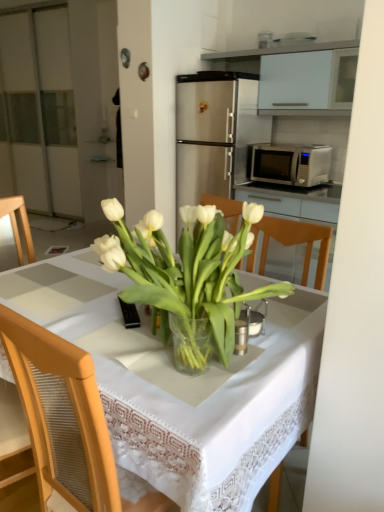
Question: Can you confirm if white glossy cabinet at upper center is shorter than transparent glass vase at center?

Choices:
 (A) no
 (B) yes

Answer: (B)

Question: Is white glossy cabinet at upper center taller than transparent glass vase at center?

Choices:
 (A) yes
 (B) no

Answer: (B)

Question: Considering the relative positions of white glossy cabinet at upper center and transparent glass vase at center in the image provided, is white glossy cabinet at upper center to the left of transparent glass vase at center from the viewer's perspective?

Choices:
 (A) yes
 (B) no

Answer: (B)

Question: Is white glossy cabinet at upper center directly adjacent to transparent glass vase at center?

Choices:
 (A) no
 (B) yes

Answer: (A)

Question: Can you confirm if white glossy cabinet at upper center is smaller than transparent glass vase at center?

Choices:
 (A) yes
 (B) no

Answer: (A)

Question: Looking at their shapes, would you say satin silver microwave at center right is wider or thinner than white glossy cabinet at upper center?

Choices:
 (A) wide
 (B) thin

Answer: (A)

Question: Is satin silver microwave at center right taller or shorter than white glossy cabinet at upper center?

Choices:
 (A) tall
 (B) short

Answer: (B)

Question: Which is correct: satin silver microwave at center right is inside white glossy cabinet at upper center, or outside of it?

Choices:
 (A) outside
 (B) inside

Answer: (A)

Question: Is satin silver microwave at center right bigger or smaller than white glossy cabinet at upper center?

Choices:
 (A) small
 (B) big

Answer: (A)

Question: From a real-world perspective, is transparent glass vase at center above or below white glossy cabinet at upper center?

Choices:
 (A) above
 (B) below

Answer: (B)

Question: Is transparent glass vase at center taller or shorter than white glossy cabinet at upper center?

Choices:
 (A) short
 (B) tall

Answer: (B)

Question: Is transparent glass vase at center bigger or smaller than white glossy cabinet at upper center?

Choices:
 (A) small
 (B) big

Answer: (B)

Question: In terms of width, does transparent glass vase at center look wider or thinner when compared to white glossy cabinet at upper center?

Choices:
 (A) wide
 (B) thin

Answer: (A)

Question: Is transparent glass vase at center wider or thinner than white glass vase at center?

Choices:
 (A) wide
 (B) thin

Answer: (A)

Question: In terms of height, does transparent glass vase at center look taller or shorter compared to white glass vase at center?

Choices:
 (A) short
 (B) tall

Answer: (B)